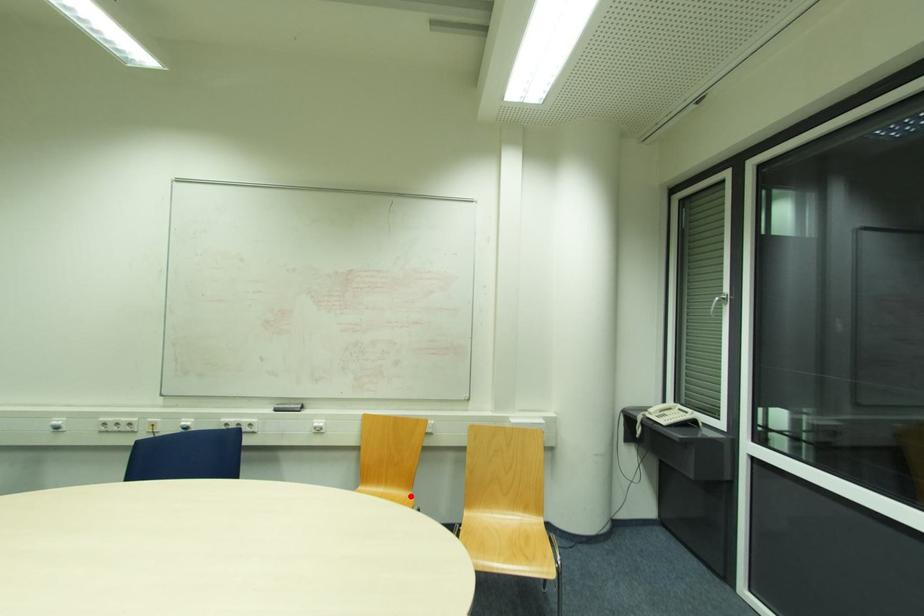
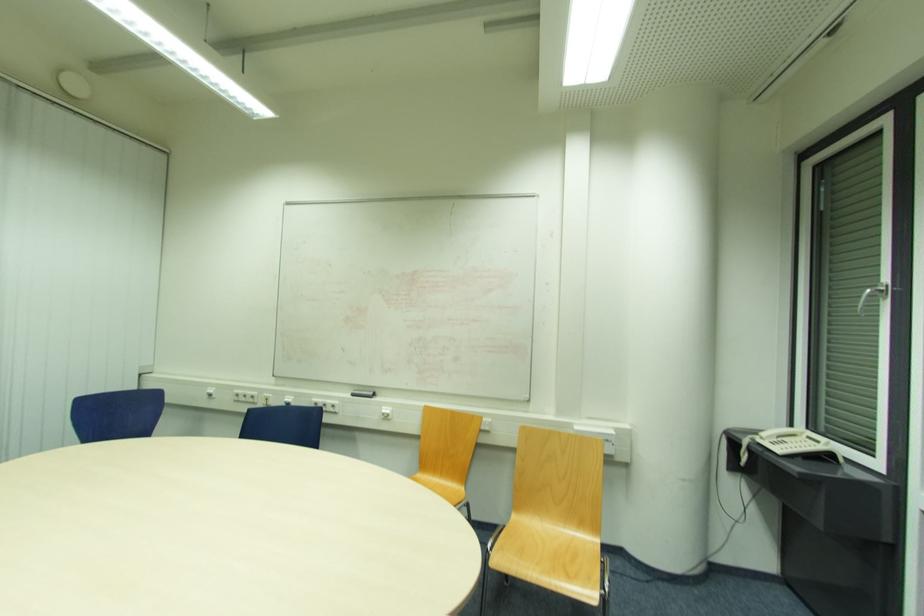
Locate, in the second image, the point that corresponds to the highlighted location in the first image.

(459, 490)